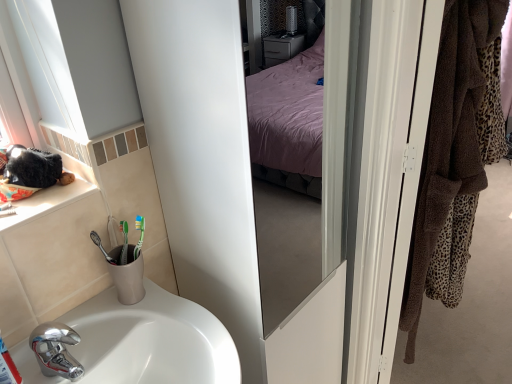
The width and height of the screenshot is (512, 384). What do you see at coordinates (426, 352) in the screenshot?
I see `brown towel at right` at bounding box center [426, 352].

I want to click on white glossy sink at lower left, so click(x=151, y=340).

Is white ceramic window sill at left at the left side of brown towel at right?

Yes.

From a real-world perspective, is white ceramic window sill at left under brown towel at right?

No, from a real-world perspective, white ceramic window sill at left is not beneath brown towel at right.

How distant is white ceramic window sill at left from brown towel at right?

white ceramic window sill at left is 4.64 feet from brown towel at right.

Is white ceramic window sill at left directly adjacent to brown towel at right?

No, white ceramic window sill at left is not with brown towel at right.

Could you tell me if white glossy sink at lower left is facing white ceramic window sill at left?

No, white glossy sink at lower left is not aimed at white ceramic window sill at left.

Which is further, [84,382] or [42,195]?

The point [42,195] is farther.

What's the angular difference between white glossy sink at lower left and white ceramic window sill at left's facing directions?

They differ by 0.000146 degrees in their facing directions.

Does white ceramic window sill at left lie in front of white glossy sink at lower left?

No, it is behind white glossy sink at lower left.

Is white ceramic window sill at left far away from white glossy sink at lower left?

They are positioned close to each other.

Does white ceramic window sill at left contain white glossy sink at lower left?

No.

Is brown towel at right inside the boundaries of white ceramic window sill at left, or outside?

brown towel at right exists outside the volume of white ceramic window sill at left.

Considering the points (432, 308) and (48, 197), which point is behind, point (432, 308) or point (48, 197)?

The point (432, 308) is farther.

Is brown towel at right wider or thinner than white ceramic window sill at left?

Clearly, brown towel at right has more width compared to white ceramic window sill at left.

How far apart are brown towel at right and white ceramic window sill at left?

brown towel at right is 1.42 meters away from white ceramic window sill at left.

From the image's perspective, is brown towel at right located above white glossy screen door at right?

Yes, from the image's perspective, brown towel at right is over white glossy screen door at right.

Which of these two, brown towel at right or white glossy screen door at right, stands taller?

white glossy screen door at right is taller.

Can you confirm if brown towel at right is positioned to the left of white glossy screen door at right?

Incorrect, brown towel at right is not on the left side of white glossy screen door at right.

Is white glossy sink at lower left smaller than brown towel at right?

Yes, white glossy sink at lower left is smaller than brown towel at right.

I want to click on door above the white glossy sink at lower left (from the image's perspective), so click(426, 352).

From the image's perspective, would you say white glossy screen door at right is shown under white glossy sink at lower left?

No, from the image's perspective, white glossy screen door at right is not below white glossy sink at lower left.

At what (x,y) coordinates should I click in order to perform the action: click on screen door above the white glossy sink at lower left (from the image's perspective). Please return your answer as a coordinate pair (x, y). This screenshot has height=384, width=512. Looking at the image, I should click on (389, 176).

Is white glossy screen door at right turned away from white glossy sink at lower left?

white glossy screen door at right does not have its back to white glossy sink at lower left.

Locate an element on the screen. door above the white ceramic window sill at left (from the image's perspective) is located at coordinates (426, 352).

Locate an element on the screen. This screenshot has width=512, height=384. sink located in front of the white ceramic window sill at left is located at coordinates (151, 340).

Considering their positions, is brown towel at right positioned further to white glossy screen door at right than white ceramic window sill at left?

Answer: white ceramic window sill at left lies further to white glossy screen door at right than the other object.

Based on their spatial positions, is white glossy screen door at right or white ceramic window sill at left further from white glossy sink at lower left?

white glossy screen door at right.

In the scene shown: Estimate the real-world distances between objects in this image. Which object is further from brown towel at right, white glossy screen door at right or white ceramic window sill at left?

white ceramic window sill at left is further to brown towel at right.

In the scene shown: Looking at the image, which one is located closer to white glossy sink at lower left, white glossy screen door at right or brown towel at right?

white glossy screen door at right is positioned closer to the anchor white glossy sink at lower left.

Estimate the real-world distances between objects in this image. Which object is closer to brown towel at right, white ceramic window sill at left or white glossy screen door at right?

The object closer to brown towel at right is white glossy screen door at right.

When comparing their distances from white glossy screen door at right, does white glossy sink at lower left or white ceramic window sill at left seem further?

white ceramic window sill at left is positioned further to the anchor white glossy screen door at right.

Based on their spatial positions, is white glossy screen door at right or brown towel at right further from white ceramic window sill at left?

Among the two, brown towel at right is located further to white ceramic window sill at left.

When comparing their distances from white glossy screen door at right, does white ceramic window sill at left or white glossy sink at lower left seem further?

Among the two, white ceramic window sill at left is located further to white glossy screen door at right.

This screenshot has height=384, width=512. I want to click on screen door between white ceramic window sill at left and brown towel at right from left to right, so click(x=389, y=176).

Where is `sink between white ceramic window sill at left and white glossy screen door at right`? This screenshot has width=512, height=384. sink between white ceramic window sill at left and white glossy screen door at right is located at coordinates (151, 340).

In order to click on sink between white ceramic window sill at left and brown towel at right in this screenshot , I will do `click(151, 340)`.

This screenshot has height=384, width=512. In order to click on screen door located between white glossy sink at lower left and brown towel at right in the left-right direction in this screenshot , I will do `click(389, 176)`.